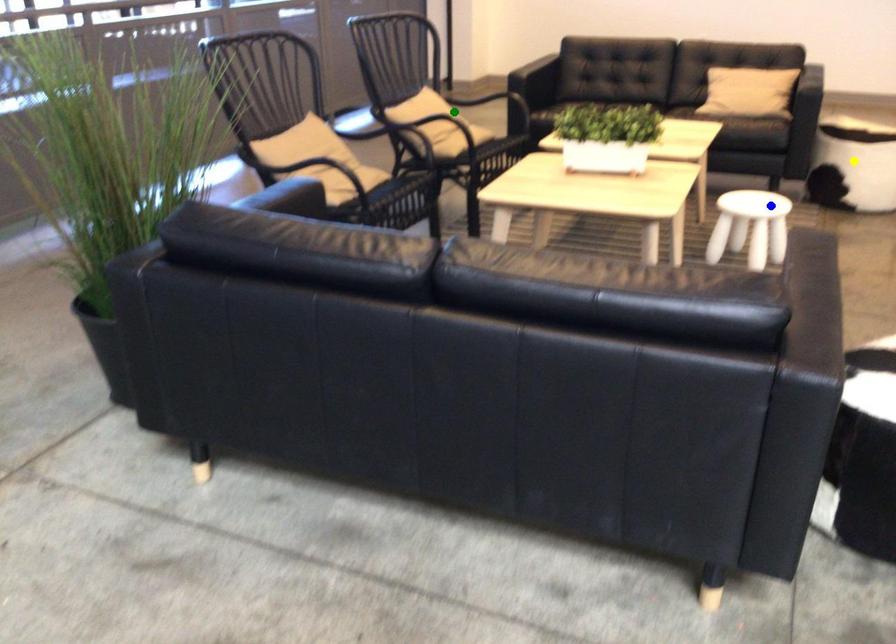
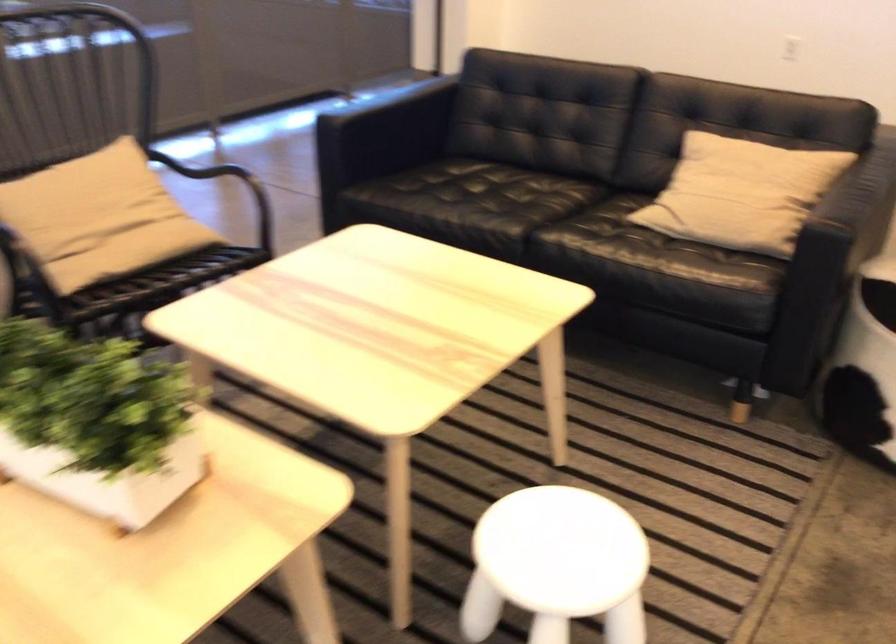
I am providing you with two images of the same scene from different viewpoints. Three points are marked in image1. Which point corresponds to a part or object that is occluded in image2?In image1, three points are marked. Which of them correspond to a part or object that is occluded in image2?Among the three points shown in image1, which one corresponds to a part or object that is no longer visible due to occlusion in image2?

Invisible in image2: yellow point.